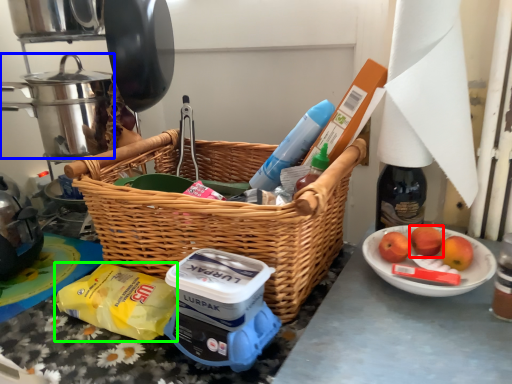
Question: Estimate the real-world distances between objects in this image. Which object is farther from apple (highlighted by a red box), crock pot (highlighted by a blue box) or food (highlighted by a green box)?

Choices:
 (A) crock pot
 (B) food

Answer: (A)